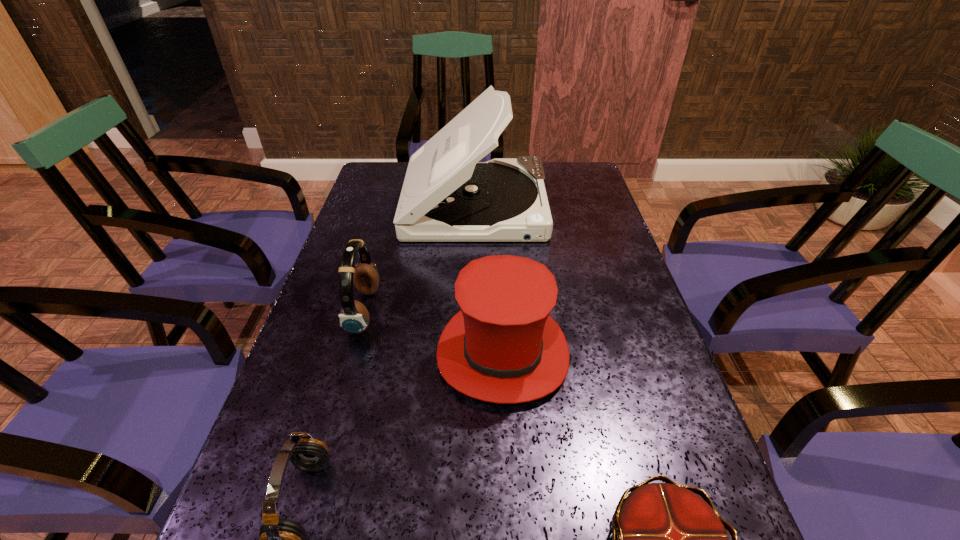
What are the coordinates of `object that is at the far left corner` in the screenshot? It's located at (448, 195).

The width and height of the screenshot is (960, 540). Find the location of `vacant space at the left edge of the desktop`. vacant space at the left edge of the desktop is located at coordinates (339, 275).

Locate an element on the screen. Image resolution: width=960 pixels, height=540 pixels. vacant point at the right edge is located at coordinates pyautogui.click(x=612, y=299).

In the image, there is a desktop. Identify the location of vacant area at the far left corner. This screenshot has width=960, height=540. (397, 181).

In the image, there is a desktop. At what (x,y) coordinates should I click in order to perform the action: click on vacant space at the far right corner. Please return your answer as a coordinate pair (x, y). Looking at the image, I should click on (571, 191).

At what (x,y) coordinates should I click in order to perform the action: click on free spot between the taller headset and the hat. Please return your answer as a coordinate pair (x, y). Looking at the image, I should click on (434, 333).

The height and width of the screenshot is (540, 960). Find the location of `vacant space that's between the taller headset and the CD player`. vacant space that's between the taller headset and the CD player is located at coordinates (420, 258).

Locate which object ranks in proximity to the nearer headset. Please provide its 2D coordinates. Your answer should be formatted as a tuple, i.e. [(x, y)], where the tuple contains the x and y coordinates of a point satisfying the conditions above.

[(503, 347)]

Select which object is the second closest to the crown. Please provide its 2D coordinates. Your answer should be formatted as a tuple, i.e. [(x, y)], where the tuple contains the x and y coordinates of a point satisfying the conditions above.

[(280, 539)]

Where is `vacant space that satisfies the following two spatial constraints: 1. on the control panel of the hat; 2. on the right side of the CD player`? The height and width of the screenshot is (540, 960). vacant space that satisfies the following two spatial constraints: 1. on the control panel of the hat; 2. on the right side of the CD player is located at coordinates (473, 354).